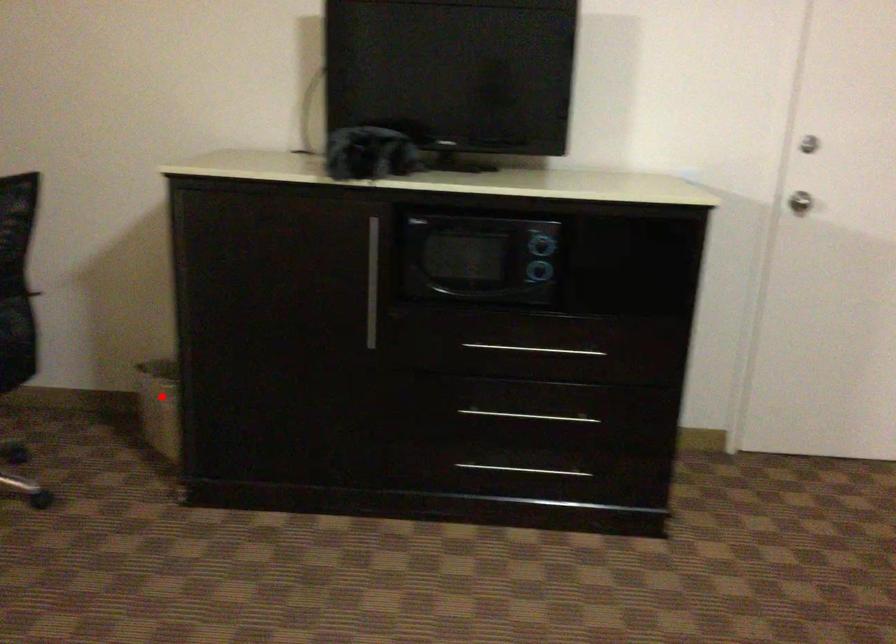
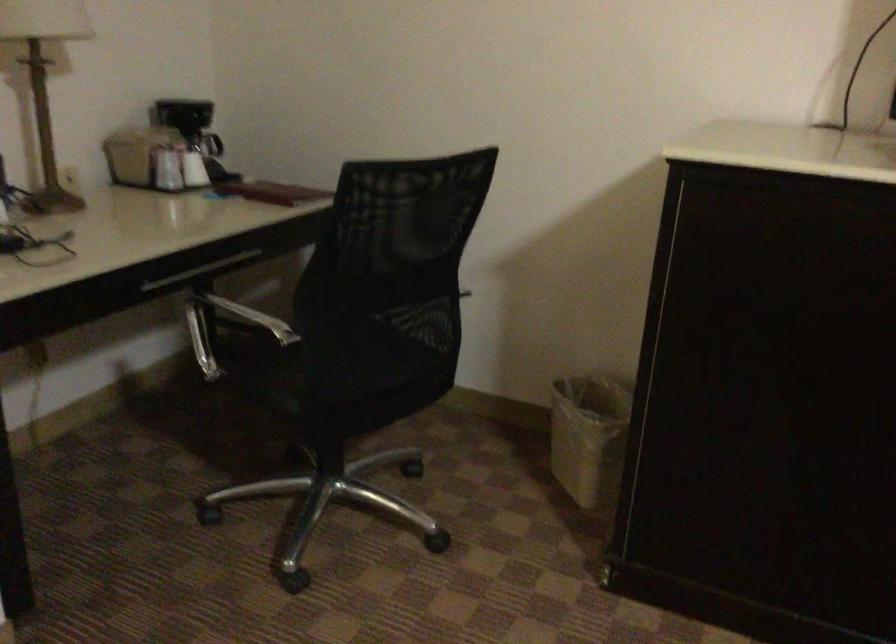
Where in the second image is the point corresponding to the highlighted location from the first image?

(589, 437)